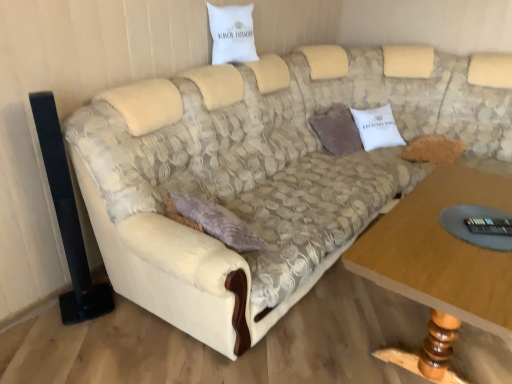
Question: Can you confirm if fuzzy brown pillow at right, the second pillow viewed from the top, is taller than transparent glass remote control at lower right?

Choices:
 (A) no
 (B) yes

Answer: (B)

Question: From a real-world perspective, is fuzzy brown pillow at right, the 1th pillow from the back, over transparent glass remote control at lower right?

Choices:
 (A) yes
 (B) no

Answer: (B)

Question: Considering the relative sizes of fuzzy brown pillow at right, placed as the first pillow when sorted from bottom to top, and transparent glass remote control at lower right in the image provided, is fuzzy brown pillow at right, placed as the first pillow when sorted from bottom to top, thinner than transparent glass remote control at lower right?

Choices:
 (A) yes
 (B) no

Answer: (B)

Question: From the image's perspective, is fuzzy brown pillow at right, placed as the first pillow when sorted from bottom to top, located above transparent glass remote control at lower right?

Choices:
 (A) yes
 (B) no

Answer: (A)

Question: Is fuzzy brown pillow at right, the 2th pillow in the front-to-back sequence, at the right side of transparent glass remote control at lower right?

Choices:
 (A) yes
 (B) no

Answer: (A)

Question: Is fuzzy brown pillow at right, acting as the first pillow starting from the right, positioned before transparent glass remote control at lower right?

Choices:
 (A) yes
 (B) no

Answer: (B)

Question: Is white fabric pillow at upper center, acting as the first pillow starting from the front, positioned behind beige fabric couch at center?

Choices:
 (A) no
 (B) yes

Answer: (B)

Question: From a real-world perspective, does white fabric pillow at upper center, marked as the second pillow in a bottom-to-top arrangement, sit lower than beige fabric couch at center?

Choices:
 (A) yes
 (B) no

Answer: (B)

Question: Is white fabric pillow at upper center, marked as the second pillow in a bottom-to-top arrangement, beside beige fabric couch at center?

Choices:
 (A) yes
 (B) no

Answer: (B)

Question: From the image's perspective, is white fabric pillow at upper center, the 1th pillow viewed from the left, over beige fabric couch at center?

Choices:
 (A) yes
 (B) no

Answer: (A)

Question: Can beige fabric couch at center be found inside white fabric pillow at upper center, which is the 1th pillow in top-to-bottom order?

Choices:
 (A) yes
 (B) no

Answer: (B)

Question: Is white fabric pillow at upper center, which is the 1th pillow in top-to-bottom order, positioned in front of beige fabric couch at center?

Choices:
 (A) no
 (B) yes

Answer: (A)

Question: From a real-world perspective, is transparent glass remote control at lower right physically below wooden table at lower right?

Choices:
 (A) yes
 (B) no

Answer: (B)